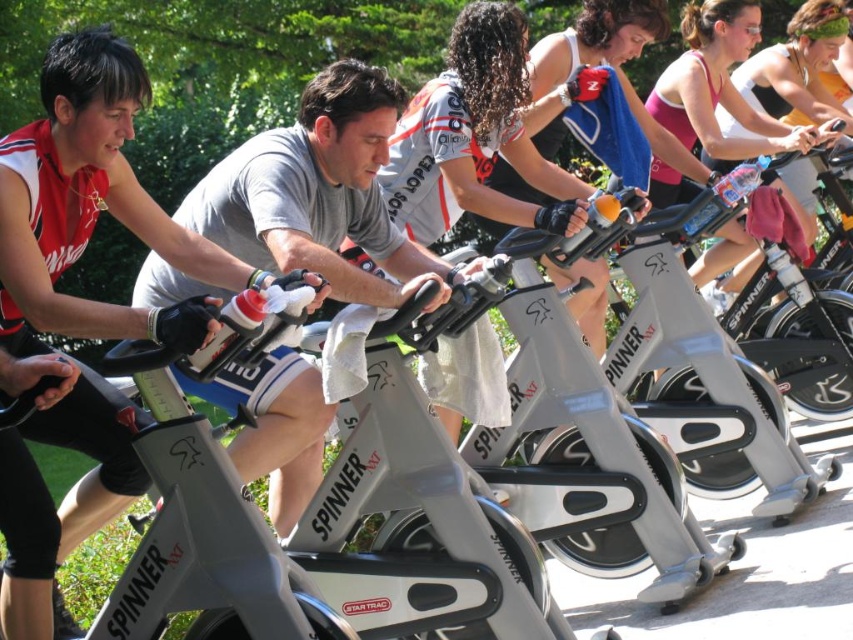
Locate an element on the screen. This screenshot has height=640, width=853. matte black tank top at left is located at coordinates (91, 205).

Does matte black tank top at left have a greater height compared to pink fabric tank top at upper center?

Yes.

Where is `matte black tank top at left`? The image size is (853, 640). matte black tank top at left is located at coordinates (91, 205).

At what (x,y) coordinates should I click in order to perform the action: click on matte black tank top at left. Please return your answer as a coordinate pair (x, y). The image size is (853, 640). Looking at the image, I should click on (91, 205).

Is point (129, 48) farther from camera compared to point (372, 173)?

No, (129, 48) is closer to viewer.

Between point (80, 52) and point (190, 195), which one is positioned behind?

The point (190, 195) is more distant.

Locate an element on the screen. The width and height of the screenshot is (853, 640). matte black tank top at left is located at coordinates (91, 205).

Identify the location of matte black tank top at left. (91, 205).

Which is behind, point (279, 132) or point (714, 116)?

Positioned behind is point (714, 116).

Is gray matte spin bike at center smaller than pink fabric tank top at upper center?

Incorrect, gray matte spin bike at center is not smaller in size than pink fabric tank top at upper center.

This screenshot has width=853, height=640. In order to click on gray matte spin bike at center in this screenshot , I will do `click(318, 193)`.

This screenshot has width=853, height=640. I want to click on gray matte spin bike at center, so click(318, 193).